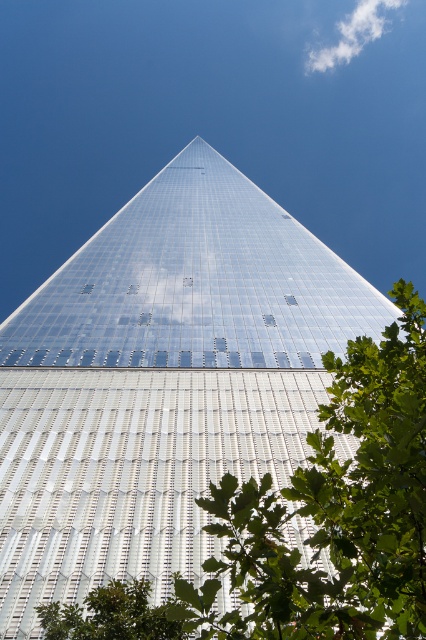
Question: Is the position of green leafy tree at lower center more distant than that of white fluffy cloud at upper center?

Choices:
 (A) yes
 (B) no

Answer: (B)

Question: Which object is farther from the camera taking this photo?

Choices:
 (A) white fluffy cloud at upper center
 (B) green leafy tree at lower center

Answer: (A)

Question: Which point is closer to the camera?

Choices:
 (A) green leafy tree at center
 (B) green leafy tree at lower center
 (C) white fluffy cloud at upper center

Answer: (A)

Question: Is green leafy tree at lower center thinner than white fluffy cloud at upper center?

Choices:
 (A) yes
 (B) no

Answer: (A)

Question: Is green leafy tree at lower center bigger than white fluffy cloud at upper center?

Choices:
 (A) yes
 (B) no

Answer: (B)

Question: Among these points, which one is farthest from the camera?

Choices:
 (A) (46, 621)
 (B) (347, 13)
 (C) (181, 593)

Answer: (B)